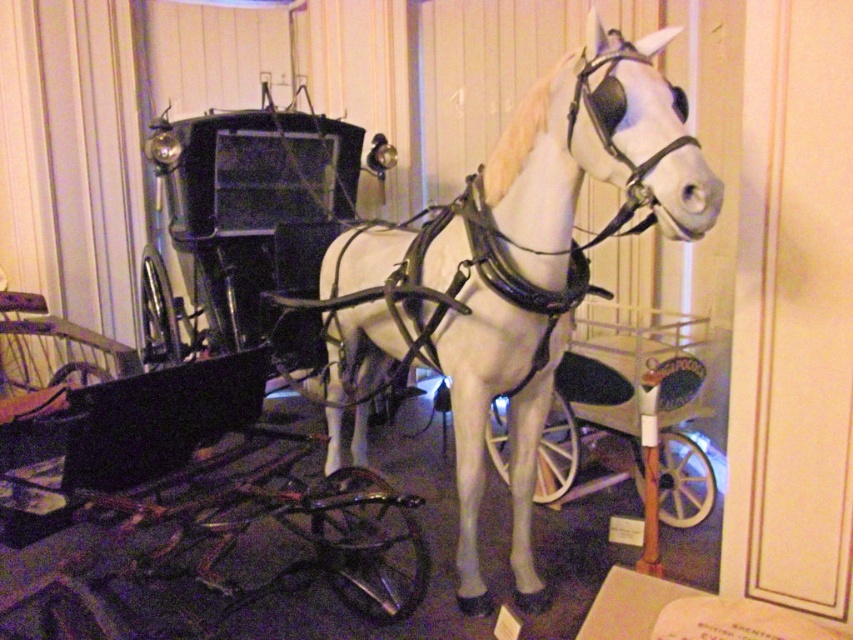
Is white glossy horse at center positioned behind metallic silver cart at center?

No, white glossy horse at center is closer to the viewer.

The image size is (853, 640). In order to click on white glossy horse at center in this screenshot , I will do `click(511, 273)`.

What do you see at coordinates (511, 273) in the screenshot? I see `white glossy horse at center` at bounding box center [511, 273].

Where is `white glossy horse at center`? white glossy horse at center is located at coordinates (511, 273).